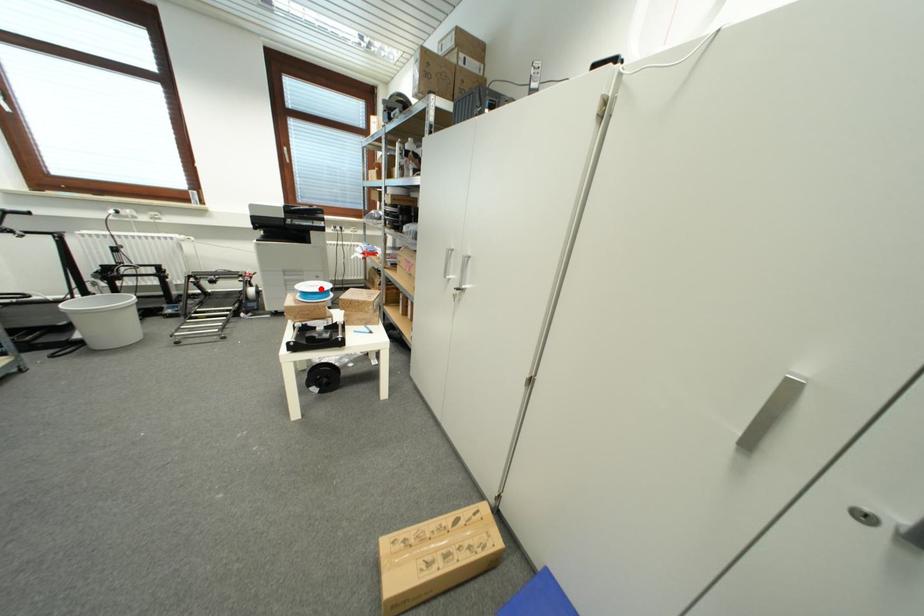
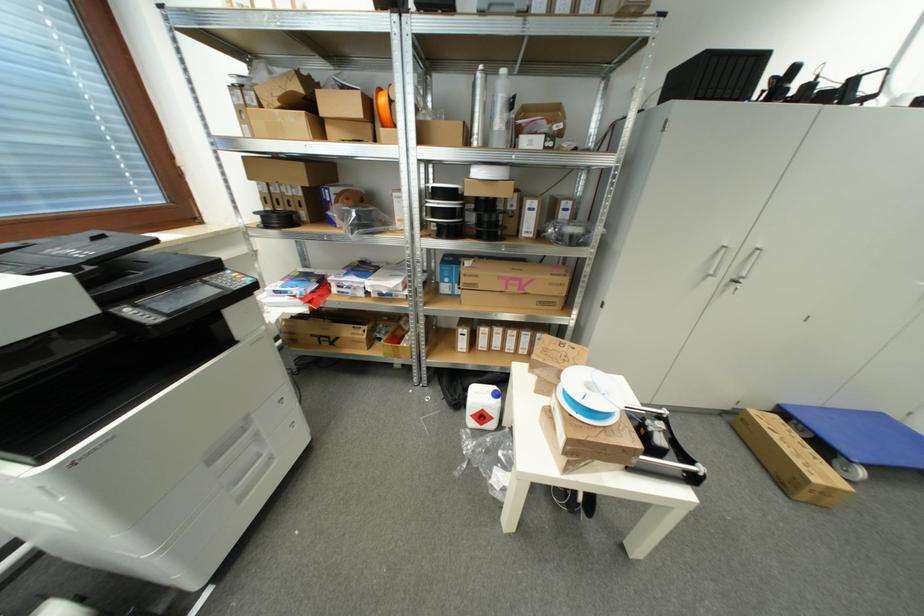
The point at the highlighted location is marked in the first image. Where is the corresponding point in the second image?

(594, 387)